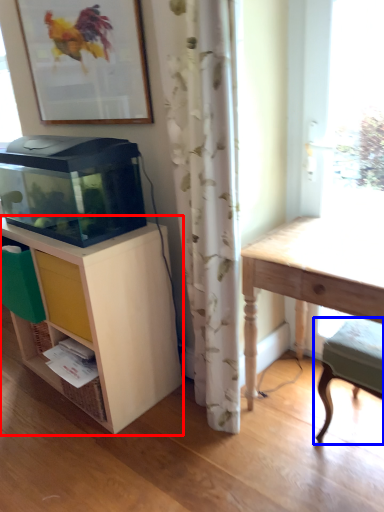
Question: Which object appears closest to the camera in this image, shelf (highlighted by a red box) or step stool (highlighted by a blue box)?

Choices:
 (A) shelf
 (B) step stool

Answer: (B)